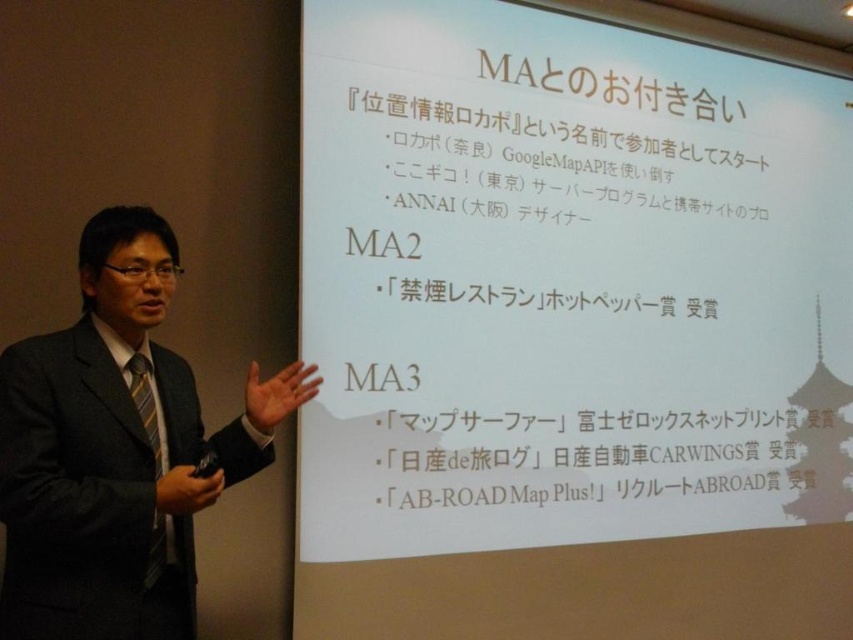
Which is in front, point (466, 342) or point (15, 534)?

Positioned in front is point (15, 534).

Based on the photo, can you confirm if white paper at upper center is wider than dark gray suit at left?

Yes, white paper at upper center is wider than dark gray suit at left.

Where is `white paper at upper center`? white paper at upper center is located at coordinates (566, 282).